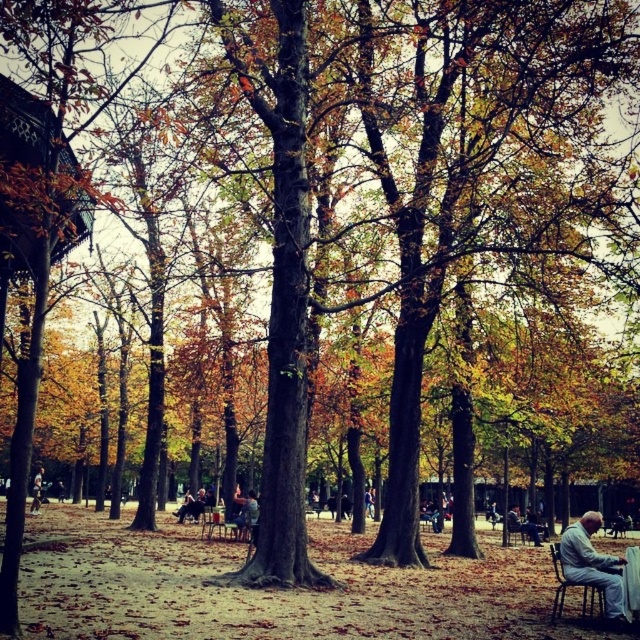
Does light gray fabric jacket at lower right have a greater height compared to gray fabric jacket at lower right?

Indeed, light gray fabric jacket at lower right has a greater height compared to gray fabric jacket at lower right.

Does point (586, 564) come in front of point (516, 506)?

Yes, point (586, 564) is in front of point (516, 506).

Where is `light gray fabric jacket at lower right`? The height and width of the screenshot is (640, 640). light gray fabric jacket at lower right is located at coordinates (593, 564).

Is the position of light gray fabric jacket at lower right less distant than that of wooden chair at lower right?

Yes.

The image size is (640, 640). In order to click on light gray fabric jacket at lower right in this screenshot , I will do `click(593, 564)`.

Consider the image. Who is more forward, (598, 612) or (515, 531)?

Point (598, 612)

Between wooden chair at lower right and gray fabric jacket at lower right, which one appears on the left side from the viewer's perspective?

wooden chair at lower right

The height and width of the screenshot is (640, 640). Identify the location of wooden chair at lower right. (573, 586).